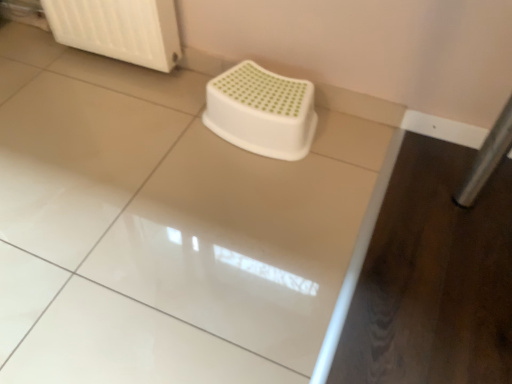
Question: From the image's perspective, relative to white plastic stool at center, is white glossy counter top at center above or below?

Choices:
 (A) below
 (B) above

Answer: (A)

Question: Which is correct: white glossy counter top at center is inside white plastic stool at center, or outside of it?

Choices:
 (A) outside
 (B) inside

Answer: (A)

Question: Based on their relative distances, which object is farther from the white plastic stool at center?

Choices:
 (A) white plastic radiator at upper left
 (B) white glossy counter top at center

Answer: (A)

Question: Based on their relative distances, which object is farther from the white glossy counter top at center?

Choices:
 (A) white plastic radiator at upper left
 (B) white plastic stool at center

Answer: (A)